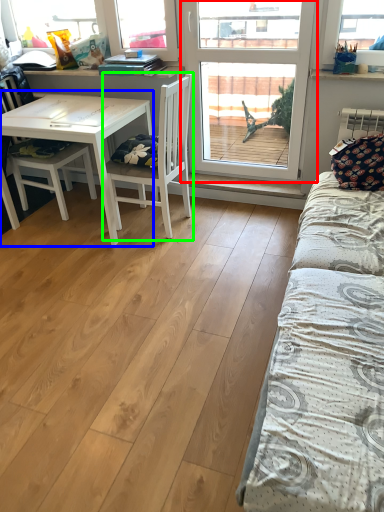
Question: Estimate the real-world distances between objects in this image. Which object is closer to window (highlighted by a red box), table (highlighted by a blue box) or chair (highlighted by a green box)?

Choices:
 (A) table
 (B) chair

Answer: (B)